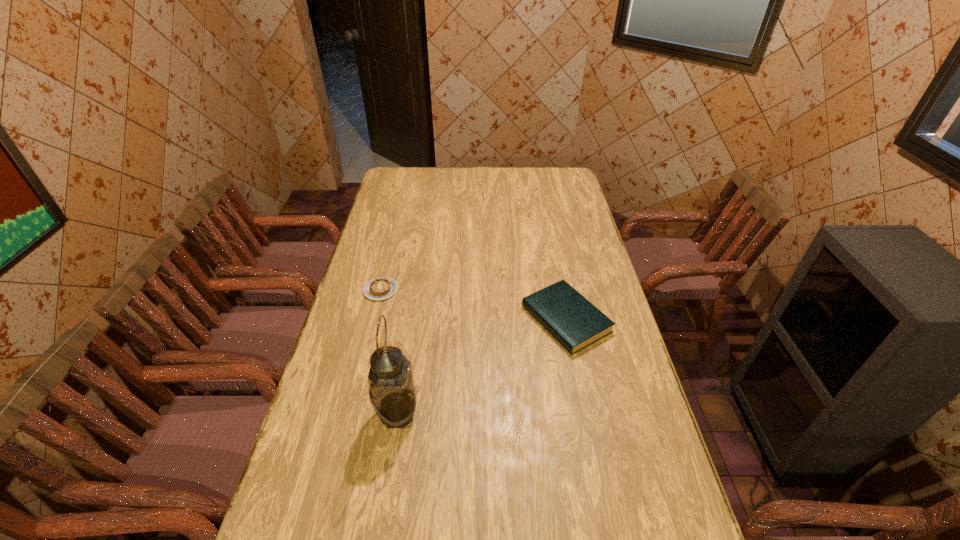
You are a GUI agent. You are given a task and a screenshot of the screen. Output one action in this format:
    pyautogui.click(x=<x>, y=<y>)
    Task: Click on the object located at the right edge
    
    Given the screenshot: What is the action you would take?
    pyautogui.click(x=569, y=317)

Locate an element on the screen. free space at the far edge of the desktop is located at coordinates (459, 171).

Image resolution: width=960 pixels, height=540 pixels. I want to click on vacant space at the left edge of the desktop, so click(362, 362).

In the image, there is a desktop. Identify the location of vacant space at the right edge. (678, 518).

In the image, there is a desktop. Find the location of `vacant space at the far left corner`. vacant space at the far left corner is located at coordinates (407, 177).

Where is `vacant space at the far right corner of the desktop`? The image size is (960, 540). vacant space at the far right corner of the desktop is located at coordinates (550, 171).

At what (x,y) coordinates should I click in order to perform the action: click on unoccupied area between the rightmost object and the quiche. Please return your answer as a coordinate pair (x, y). The width and height of the screenshot is (960, 540). Looking at the image, I should click on pos(473,305).

Find the location of a particular element. Image resolution: width=960 pixels, height=540 pixels. free space between the rightmost object and the oil lamp is located at coordinates (482, 367).

Find the location of a particular element. Image resolution: width=960 pixels, height=540 pixels. vacant area between the nearest object and the rightmost object is located at coordinates (482, 367).

Find the location of a particular element. free spot between the nearest object and the book is located at coordinates (482, 367).